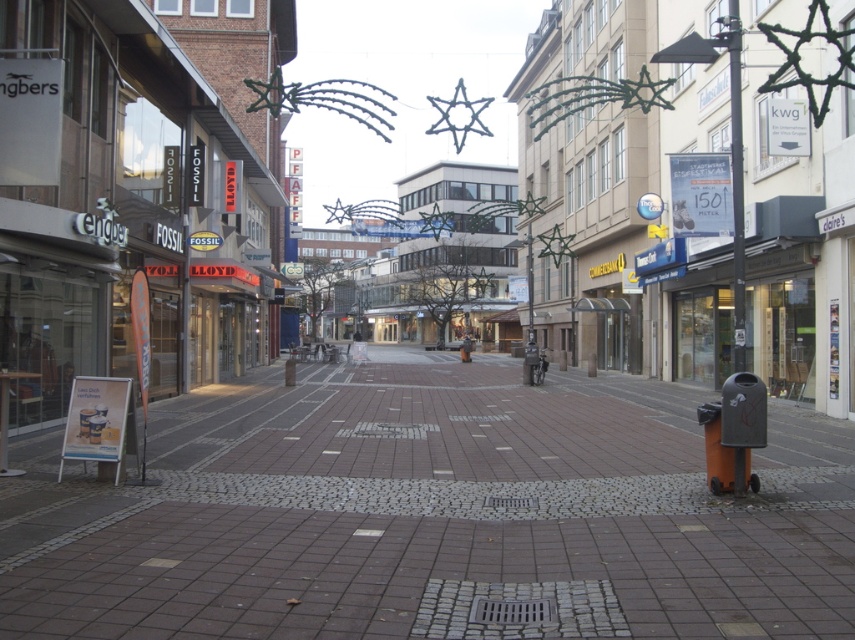
Question: Which point is farther from the camera taking this photo?

Choices:
 (A) tap(391, 298)
 (B) tap(782, 445)

Answer: (A)

Question: Which point appears farthest from the camera in this image?

Choices:
 (A) (770, 392)
 (B) (851, 484)

Answer: (A)

Question: Can you confirm if brick paved street at center is smaller than matte black trash can at lower right?

Choices:
 (A) yes
 (B) no

Answer: (A)

Question: Which object is closer to the camera taking this photo?

Choices:
 (A) brick paved street at center
 (B) matte black trash can at lower right

Answer: (A)

Question: Is brick paved street at center further to camera compared to matte black trash can at lower right?

Choices:
 (A) yes
 (B) no

Answer: (B)

Question: Does brick paved street at center lie behind matte black trash can at lower right?

Choices:
 (A) yes
 (B) no

Answer: (B)